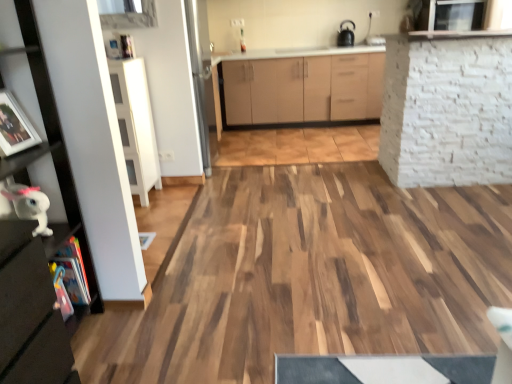
I want to click on vacant space to the right of matte black shelf at left, acting as the 2th cabinetry starting from the top, so click(x=143, y=339).